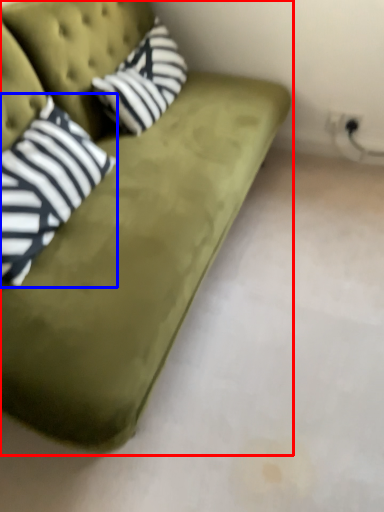
Question: Which object appears closest to the camera in this image, studio couch (highlighted by a red box) or pillow (highlighted by a blue box)?

Choices:
 (A) studio couch
 (B) pillow

Answer: (A)